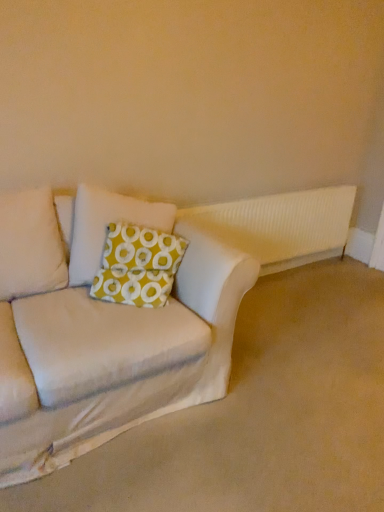
Question: In terms of height, does white ribbed radiator at upper right look taller or shorter compared to beige fabric couch at lower left?

Choices:
 (A) tall
 (B) short

Answer: (A)

Question: Is point (289, 236) positioned closer to the camera than point (11, 195)?

Choices:
 (A) closer
 (B) farther

Answer: (B)

Question: Which object is the farthest from the white ribbed radiator at upper right?

Choices:
 (A) yellowpatterned fabricpillow at center
 (B) beige fabric couch at lower left
 (C) green fabric pillow at center

Answer: (B)

Question: Which is nearer to the green fabric pillow at center?

Choices:
 (A) white ribbed radiator at upper right
 (B) yellowpatterned fabricpillow at center
 (C) beige fabric couch at lower left

Answer: (B)